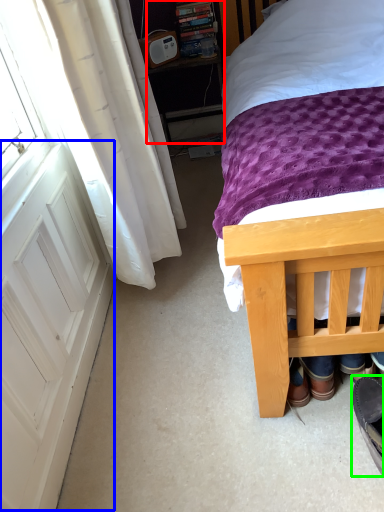
Question: Which is farther away from nightstand (highlighted by a red box)? screen door (highlighted by a blue box) or footwear (highlighted by a green box)?

Choices:
 (A) screen door
 (B) footwear

Answer: (B)